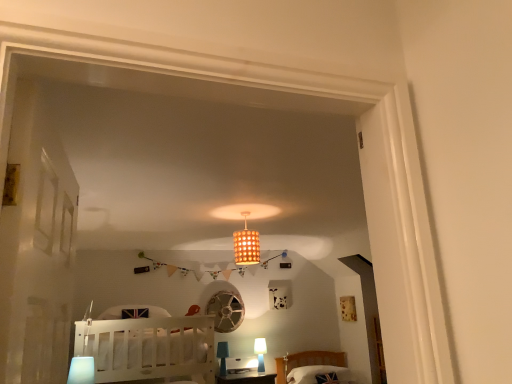
Where is `blue frosted glass lamp at lower left, acting as the 1th lamp starting from the front`? blue frosted glass lamp at lower left, acting as the 1th lamp starting from the front is located at coordinates (81, 370).

What do you see at coordinates (223, 356) in the screenshot? Image resolution: width=512 pixels, height=384 pixels. I see `blue glass lamp at lower center, the third lamp viewed from the top` at bounding box center [223, 356].

Describe the element at coordinates (317, 374) in the screenshot. I see `white fabric pillow at lower right` at that location.

At what (x,y) coordinates should I click in order to perform the action: click on white fabric pillow at lower right. Please return your answer as a coordinate pair (x, y). This screenshot has height=384, width=512. Looking at the image, I should click on (317, 374).

What do you see at coordinates (246, 244) in the screenshot? This screenshot has height=384, width=512. I see `wooden textured lampshade at center, which is the first lamp in top-to-bottom order` at bounding box center [246, 244].

Consider the image. Measure the distance between point (243, 239) and camera.

They are 3.37 meters apart.

You are a GUI agent. You are given a task and a screenshot of the screen. Output one action in this format:
    pyautogui.click(x=<x>, y=<y>)
    Task: Click on the matte white lamp at lower center, placed as the 1th lamp when sorted from back to front
    
    Given the screenshot: What is the action you would take?
    pyautogui.click(x=260, y=353)

Does white wood crib at lower left have a greater width compared to wooden textured lampshade at center, which is the first lamp in top-to-bottom order?

Yes, white wood crib at lower left is wider than wooden textured lampshade at center, which is the first lamp in top-to-bottom order.

Looking at this image, from the image's perspective, is white wood crib at lower left located beneath wooden textured lampshade at center, which is the first lamp in top-to-bottom order?

Correct, white wood crib at lower left appears lower than wooden textured lampshade at center, which is the first lamp in top-to-bottom order, in the image.

Is white wood crib at lower left not within wooden textured lampshade at center, arranged as the fourth lamp when ordered from the bottom?

Yes, white wood crib at lower left is located beyond the bounds of wooden textured lampshade at center, arranged as the fourth lamp when ordered from the bottom.

Can you confirm if white wood crib at lower left is smaller than wooden textured lampshade at center, the 3th lamp viewed from the left?

No, white wood crib at lower left is not smaller than wooden textured lampshade at center, the 3th lamp viewed from the left.

Could you measure the distance between wooden textured lampshade at center, which appears as the second lamp when viewed from the right, and blue frosted glass lamp at lower left, the 2th lamp in the top-to-bottom sequence?

A distance of 4.53 feet exists between wooden textured lampshade at center, which appears as the second lamp when viewed from the right, and blue frosted glass lamp at lower left, the 2th lamp in the top-to-bottom sequence.

Can you tell me how much wooden textured lampshade at center, which is the first lamp in top-to-bottom order, and blue frosted glass lamp at lower left, the 1th lamp positioned from the left, differ in facing direction?

90 degrees separate the facing orientations of wooden textured lampshade at center, which is the first lamp in top-to-bottom order, and blue frosted glass lamp at lower left, the 1th lamp positioned from the left.

In the scene shown: Who is shorter, wooden textured lampshade at center, which appears as the second lamp when viewed from the right, or blue frosted glass lamp at lower left, which ranks as the fourth lamp in back-to-front order?

blue frosted glass lamp at lower left, which ranks as the fourth lamp in back-to-front order.

From a real-world perspective, who is located higher, wooden textured lampshade at center, the third lamp in the back-to-front sequence, or blue frosted glass lamp at lower left, the third lamp from the bottom?

wooden textured lampshade at center, the third lamp in the back-to-front sequence, is physically above.

Is point (220, 351) farther from camera compared to point (108, 328)?

Yes.

Considering the relative sizes of blue glass lamp at lower center, the second lamp from the left, and white wood crib at lower left in the image provided, is blue glass lamp at lower center, the second lamp from the left, bigger than white wood crib at lower left?

No, blue glass lamp at lower center, the second lamp from the left, is not bigger than white wood crib at lower left.

From the image's perspective, relative to blue glass lamp at lower center, marked as the 2th lamp in a back-to-front arrangement, is white fabric pillow at lower right above or below?

white fabric pillow at lower right is situated lower than blue glass lamp at lower center, marked as the 2th lamp in a back-to-front arrangement, in the image.

Looking at this image, is white fabric pillow at lower right wider than blue glass lamp at lower center, arranged as the 3th lamp when viewed from the right?

Yes.

Is point (311, 379) closer to viewer compared to point (219, 342)?

Yes, it is in front of point (219, 342).

Is white fabric pillow at lower right at the left side of blue glass lamp at lower center, the second lamp from the left?

No.

Is white fabric pillow at lower right placed right next to wooden textured lampshade at center, which is the first lamp in top-to-bottom order?

white fabric pillow at lower right and wooden textured lampshade at center, which is the first lamp in top-to-bottom order, are clearly separated.

Can you confirm if white fabric pillow at lower right is positioned to the left of wooden textured lampshade at center, arranged as the fourth lamp when ordered from the bottom?

No, white fabric pillow at lower right is not to the left of wooden textured lampshade at center, arranged as the fourth lamp when ordered from the bottom.

Between white fabric pillow at lower right and wooden textured lampshade at center, arranged as the fourth lamp when ordered from the bottom, which one has larger size?

white fabric pillow at lower right.

Does white fabric pillow at lower right have a greater height compared to wooden textured lampshade at center, which appears as the second lamp when viewed from the right?

No.

Is point (239, 251) closer or farther from the camera than point (336, 372)?

Point (239, 251) is positioned closer to the camera compared to point (336, 372).

Would you say white fabric pillow at lower right is part of wooden textured lampshade at center, arranged as the fourth lamp when ordered from the bottom,'s contents?

No, white fabric pillow at lower right is not surrounded by wooden textured lampshade at center, arranged as the fourth lamp when ordered from the bottom.

I want to click on pillow beneath the wooden textured lampshade at center, the third lamp in the back-to-front sequence (from a real-world perspective), so click(317, 374).

Does matte white lamp at lower center, the fourth lamp viewed from the top, appear on the left side of blue frosted glass lamp at lower left, acting as the 1th lamp starting from the front?

Incorrect, matte white lamp at lower center, the fourth lamp viewed from the top, is not on the left side of blue frosted glass lamp at lower left, acting as the 1th lamp starting from the front.

Looking at this image, from the image's perspective, which is above, matte white lamp at lower center, placed as the 1th lamp when sorted from back to front, or blue frosted glass lamp at lower left, the 1th lamp positioned from the left?

blue frosted glass lamp at lower left, the 1th lamp positioned from the left.

Would you consider matte white lamp at lower center, placed as the 1th lamp when sorted from back to front, to be distant from blue frosted glass lamp at lower left, acting as the 1th lamp starting from the front?

Yes, matte white lamp at lower center, placed as the 1th lamp when sorted from back to front, and blue frosted glass lamp at lower left, acting as the 1th lamp starting from the front, are located far from each other.

The height and width of the screenshot is (384, 512). What are the coordinates of `furniture on the left of wooden textured lampshade at center, which is the first lamp in top-to-bottom order` in the screenshot? It's located at (153, 349).

Identify the location of the 1st lamp behind the blue frosted glass lamp at lower left, the 1th lamp positioned from the left, starting your count from the anchor. The image size is (512, 384). (246, 244).

Which object lies further to the anchor point blue glass lamp at lower center, the third lamp when ordered from front to back, blue frosted glass lamp at lower left, the third lamp from the bottom, or white wood crib at lower left?

Based on the image, blue frosted glass lamp at lower left, the third lamp from the bottom, appears to be further to blue glass lamp at lower center, the third lamp when ordered from front to back.

Based on their spatial positions, is matte white lamp at lower center, the fourth lamp viewed from the top, or white fabric pillow at lower right further from blue glass lamp at lower center, the third lamp viewed from the top?

Based on the image, white fabric pillow at lower right appears to be further to blue glass lamp at lower center, the third lamp viewed from the top.

Based on their spatial positions, is matte white lamp at lower center, arranged as the 1th lamp when ordered from the bottom, or blue glass lamp at lower center, which appears as the second lamp when ordered from the bottom, further from white wood crib at lower left?

matte white lamp at lower center, arranged as the 1th lamp when ordered from the bottom.

Looking at the image, which one is located closer to white fabric pillow at lower right, wooden textured lampshade at center, arranged as the fourth lamp when ordered from the bottom, or white wood crib at lower left?

The object closer to white fabric pillow at lower right is wooden textured lampshade at center, arranged as the fourth lamp when ordered from the bottom.

Based on their spatial positions, is white fabric pillow at lower right or blue glass lamp at lower center, which appears as the second lamp when ordered from the bottom, further from wooden textured lampshade at center, the third lamp in the back-to-front sequence?

The object further to wooden textured lampshade at center, the third lamp in the back-to-front sequence, is white fabric pillow at lower right.

Considering their positions, is matte white lamp at lower center, the first lamp in the right-to-left sequence, positioned closer to white fabric pillow at lower right than blue glass lamp at lower center, which appears as the second lamp when ordered from the bottom?

matte white lamp at lower center, the first lamp in the right-to-left sequence, is closer to white fabric pillow at lower right.

Based on their spatial positions, is wooden textured lampshade at center, arranged as the 2th lamp when viewed from the front, or blue frosted glass lamp at lower left, the 2th lamp in the top-to-bottom sequence, further from white wood crib at lower left?

Among the two, wooden textured lampshade at center, arranged as the 2th lamp when viewed from the front, is located further to white wood crib at lower left.

From the image, which object appears to be nearer to blue glass lamp at lower center, which appears as the second lamp when ordered from the bottom, blue frosted glass lamp at lower left, the 1th lamp positioned from the left, or white fabric pillow at lower right?

Among the two, white fabric pillow at lower right is located nearer to blue glass lamp at lower center, which appears as the second lamp when ordered from the bottom.

Identify the location of pillow between wooden textured lampshade at center, which is the first lamp in top-to-bottom order, and matte white lamp at lower center, arranged as the 1th lamp when ordered from the bottom, in the front-back direction. The image size is (512, 384). tap(317, 374).

This screenshot has width=512, height=384. What are the coordinates of `furniture positioned between blue frosted glass lamp at lower left, which ranks as the fourth lamp in back-to-front order, and blue glass lamp at lower center, arranged as the 3th lamp when viewed from the right, from near to far` in the screenshot? It's located at (153, 349).

At what (x,y) coordinates should I click in order to perform the action: click on lamp positioned between wooden textured lampshade at center, which appears as the second lamp when viewed from the right, and matte white lamp at lower center, marked as the fourth lamp in a left-to-right arrangement, from near to far. Please return your answer as a coordinate pair (x, y). The height and width of the screenshot is (384, 512). Looking at the image, I should click on (223, 356).

I want to click on furniture positioned between blue frosted glass lamp at lower left, the 1th lamp positioned from the left, and matte white lamp at lower center, the fourth lamp viewed from the top, from near to far, so (153, 349).